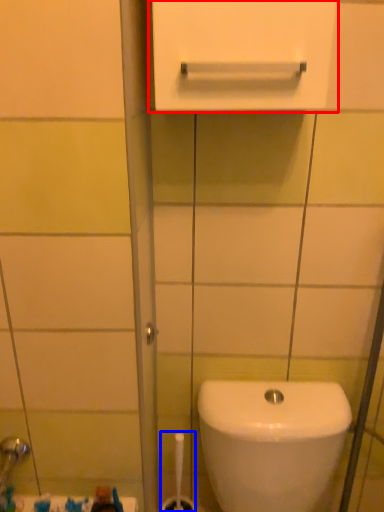
Question: Which of the following is the closest to the observer, medicine cabinet (highlighted by a red box) or brush (highlighted by a blue box)?

Choices:
 (A) medicine cabinet
 (B) brush

Answer: (A)